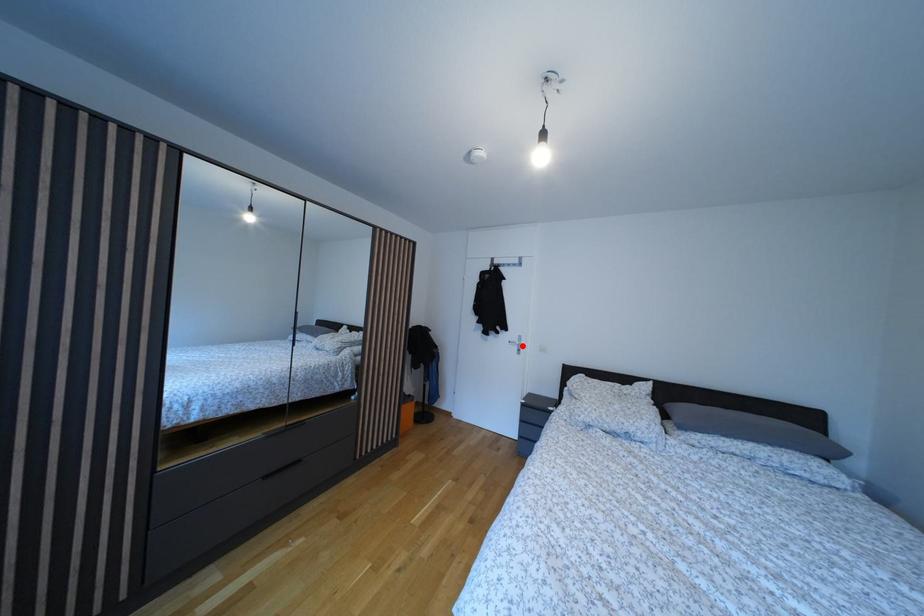
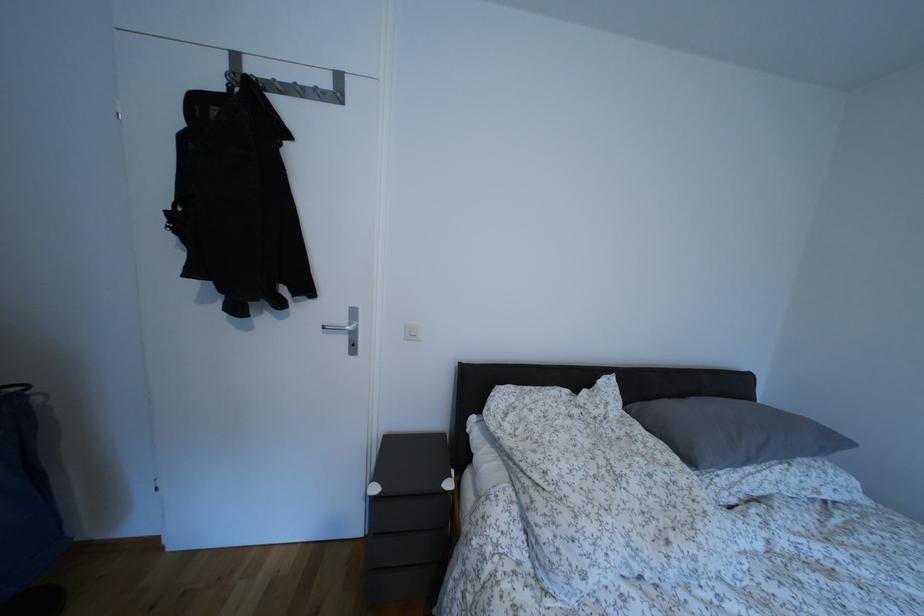
Locate, in the second image, the point that corresponds to the highlighted location in the first image.

(348, 325)